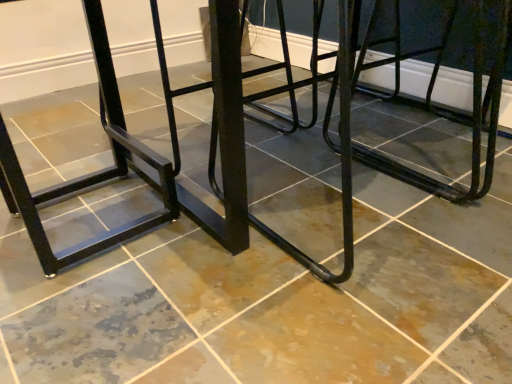
I want to click on vacant area situated below black metal table at center (from a real-world perspective), so click(x=310, y=142).